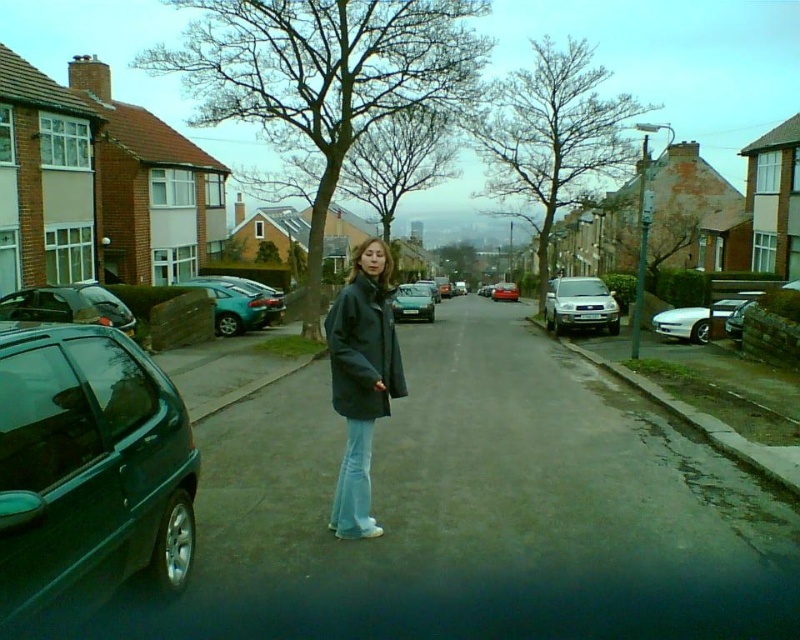
Question: Which object is positioned closest to the dark gray coat at center?

Choices:
 (A) shiny dark green hatchback at lower left
 (B) shiny black car at left

Answer: (A)

Question: Is shiny dark green hatchback at lower left above white glossy sedan at right?

Choices:
 (A) no
 (B) yes

Answer: (A)

Question: Which point is farther to the camera?

Choices:
 (A) (258, 292)
 (B) (390, 369)
 (C) (416, 292)
 (D) (66, 404)

Answer: (C)

Question: Is satin silver suv at center-right in front of teal glossy hatchback at center-left?

Choices:
 (A) no
 (B) yes

Answer: (A)

Question: Which of the following is the farthest from the observer?

Choices:
 (A) (236, 310)
 (B) (32, 381)
 (C) (588, 321)

Answer: (C)

Question: Is teal glossy hatchback at center-left thinner than white glossy sedan at right?

Choices:
 (A) yes
 (B) no

Answer: (A)